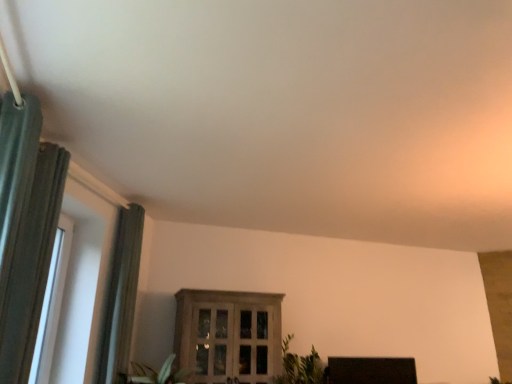
What are the coordinates of `black matte tv at lower right` in the screenshot? It's located at (371, 370).

Locate an element on the screen. The image size is (512, 384). wooden cabinet at center, the 2th window when ordered from left to right is located at coordinates (228, 335).

Image resolution: width=512 pixels, height=384 pixels. I want to click on green leafy plant at lower center, so click(x=301, y=367).

In terms of size, does green fabric curtain at left, placed as the first curtain when sorted from front to back, appear bigger or smaller than white plastic window at left, which ranks as the first window in left-to-right order?

Considering their sizes, green fabric curtain at left, placed as the first curtain when sorted from front to back, takes up more space than white plastic window at left, which ranks as the first window in left-to-right order.

Could you tell me if green fabric curtain at left, positioned as the second curtain in back-to-front order, is facing white plastic window at left, which is the 1th window from front to back?

No, green fabric curtain at left, positioned as the second curtain in back-to-front order, does not turn towards white plastic window at left, which is the 1th window from front to back.

Does green fabric curtain at left, placed as the first curtain when sorted from front to back, lie behind white plastic window at left, which is the 1th window from front to back?

That is False.

From the picture: Which of these two, green fabric curtain at left, positioned as the second curtain in back-to-front order, or white plastic window at left, which ranks as the first window in left-to-right order, is wider?

Wider between the two is green fabric curtain at left, positioned as the second curtain in back-to-front order.

Is green leafy plant at lower center far from white plastic window at left, which ranks as the first window in left-to-right order?

Indeed, green leafy plant at lower center is not near white plastic window at left, which ranks as the first window in left-to-right order.

Does green leafy plant at lower center have a greater height compared to white plastic window at left, which is the 1th window from front to back?

No.

Is green leafy plant at lower center at the right side of white plastic window at left, the second window viewed from the back?

Yes.

What's the angular difference between green leafy plant at lower center and white plastic window at left, which ranks as the first window in left-to-right order,'s facing directions?

They differ by 60 degrees in their facing directions.

Can green fabric curtain at left, positioned as the second curtain in back-to-front order, be found inside green leafy plant at lower center?

That's incorrect, green fabric curtain at left, positioned as the second curtain in back-to-front order, is not inside green leafy plant at lower center.

Looking at this image, from a real-world perspective, which object rests below the other?

In real-world perspective, green leafy plant at lower center is lower.

Is point (320, 360) closer or farther from the camera than point (23, 243)?

Point (320, 360) is positioned farther from the camera compared to point (23, 243).

Is green leafy plant at lower center wider or thinner than green fabric curtain at left, placed as the first curtain when sorted from front to back?

In the image, green leafy plant at lower center appears to be wider than green fabric curtain at left, placed as the first curtain when sorted from front to back.

Is point (396, 358) positioned before point (67, 246)?

No.

Which is behind, black matte tv at lower right or white plastic window at left, which is the 1th window from front to back?

Positioned behind is black matte tv at lower right.

In terms of size, does black matte tv at lower right appear bigger or smaller than white plastic window at left, which is counted as the second window, starting from the right?

In the image, black matte tv at lower right appears to be larger than white plastic window at left, which is counted as the second window, starting from the right.

From the image's perspective, who appears lower, wooden cabinet at center, which appears as the first window when viewed from the back, or green leafy plant at lower center?

green leafy plant at lower center, from the image's perspective.

From a real-world perspective, between wooden cabinet at center, placed as the 1th window when sorted from right to left, and green leafy plant at lower center, who is vertically higher?

In real-world perspective, wooden cabinet at center, placed as the 1th window when sorted from right to left, is above.

Would you say wooden cabinet at center, which appears as the first window when viewed from the back, is to the left or to the right of green leafy plant at lower center in the picture?

In the image, wooden cabinet at center, which appears as the first window when viewed from the back, appears on the left side of green leafy plant at lower center.

Where is `the 1st window counting from the left of the green leafy plant at lower center`? the 1st window counting from the left of the green leafy plant at lower center is located at coordinates (228, 335).

Is black matte tv at lower right in front of green fabric curtain at left, placed as the first curtain when sorted from front to back?

No, the depth of black matte tv at lower right is greater than that of green fabric curtain at left, placed as the first curtain when sorted from front to back.

Could you tell me if black matte tv at lower right is turned towards green fabric curtain at left, placed as the first curtain when sorted from front to back?

No, black matte tv at lower right is not turned towards green fabric curtain at left, placed as the first curtain when sorted from front to back.

Is black matte tv at lower right inside the boundaries of green fabric curtain at left, placed as the first curtain when sorted from front to back, or outside?

black matte tv at lower right is spatially situated outside green fabric curtain at left, placed as the first curtain when sorted from front to back.

Who is taller, green textured curtain at left, positioned as the first curtain in back-to-front order, or green leafy plant at lower center?

Standing taller between the two is green textured curtain at left, positioned as the first curtain in back-to-front order.

In the scene shown: How much distance is there between green textured curtain at left, positioned as the first curtain in back-to-front order, and green leafy plant at lower center?

The distance of green textured curtain at left, positioned as the first curtain in back-to-front order, from green leafy plant at lower center is 5.45 feet.

Does green textured curtain at left, acting as the 2th curtain starting from the front, have a greater width compared to green leafy plant at lower center?

Incorrect, the width of green textured curtain at left, acting as the 2th curtain starting from the front, does not surpass that of green leafy plant at lower center.

From the image's perspective, which is above, green textured curtain at left, acting as the 2th curtain starting from the front, or green leafy plant at lower center?

green textured curtain at left, acting as the 2th curtain starting from the front, appears higher in the image.

The height and width of the screenshot is (384, 512). In order to click on window that is the 1st object located behind the green fabric curtain at left, positioned as the second curtain in back-to-front order in this screenshot , I will do `click(52, 303)`.

Identify the location of window that is the 2nd one above the green leafy plant at lower center (from a real-world perspective). (52, 303).

Looking at this image, estimate the real-world distances between objects in this image. Which object is closer to green leafy plant at lower center, green fabric curtain at left, positioned as the second curtain in back-to-front order, or white plastic window at left, which ranks as the first window in left-to-right order?

The object closer to green leafy plant at lower center is white plastic window at left, which ranks as the first window in left-to-right order.

Based on the photo, which object lies further to the anchor point green leafy plant at lower center, white plastic window at left, which is counted as the second window, starting from the right, or green textured curtain at left, positioned as the first curtain in back-to-front order?

white plastic window at left, which is counted as the second window, starting from the right, lies further to green leafy plant at lower center than the other object.

Looking at the image, which one is located further to green textured curtain at left, positioned as the first curtain in back-to-front order, black matte tv at lower right or green leafy plant at lower center?

black matte tv at lower right is positioned further to the anchor green textured curtain at left, positioned as the first curtain in back-to-front order.

Considering their positions, is wooden cabinet at center, which appears as the 2th window when viewed from the front, positioned further to black matte tv at lower right than white plastic window at left, the second window viewed from the back?

white plastic window at left, the second window viewed from the back, lies further to black matte tv at lower right than the other object.

Estimate the real-world distances between objects in this image. Which object is closer to green textured curtain at left, positioned as the first curtain in back-to-front order, green leafy plant at lower center or wooden cabinet at center, which appears as the first window when viewed from the back?

wooden cabinet at center, which appears as the first window when viewed from the back, is closer to green textured curtain at left, positioned as the first curtain in back-to-front order.

When comparing their distances from green fabric curtain at left, placed as the first curtain when sorted from front to back, does wooden cabinet at center, placed as the 1th window when sorted from right to left, or green textured curtain at left, acting as the 2th curtain starting from the front, seem closer?

Among the two, green textured curtain at left, acting as the 2th curtain starting from the front, is located nearer to green fabric curtain at left, placed as the first curtain when sorted from front to back.

Looking at the image, which one is located further to green leafy plant at lower center, wooden cabinet at center, the 2th window when ordered from left to right, or green fabric curtain at left, positioned as the second curtain in back-to-front order?

The object further to green leafy plant at lower center is green fabric curtain at left, positioned as the second curtain in back-to-front order.

Based on the photo, based on their spatial positions, is green textured curtain at left, positioned as the first curtain in back-to-front order, or green leafy plant at lower center further from white plastic window at left, the second window viewed from the back?

green leafy plant at lower center is positioned further to the anchor white plastic window at left, the second window viewed from the back.

I want to click on window situated between green textured curtain at left, acting as the 2th curtain starting from the front, and black matte tv at lower right from left to right, so click(228, 335).

The height and width of the screenshot is (384, 512). What are the coordinates of `houseplant between green fabric curtain at left, placed as the first curtain when sorted from front to back, and black matte tv at lower right in the front-back direction` in the screenshot? It's located at (301, 367).

Find the location of a particular element. This screenshot has width=512, height=384. curtain located between green fabric curtain at left, placed as the first curtain when sorted from front to back, and wooden cabinet at center, placed as the 1th window when sorted from right to left, in the depth direction is located at coordinates 121,297.

You are a GUI agent. You are given a task and a screenshot of the screen. Output one action in this format:
    pyautogui.click(x=<x>, y=<y>)
    Task: Click on the window between green textured curtain at left, positioned as the first curtain in back-to-front order, and green leafy plant at lower center
    The image size is (512, 384).
    Given the screenshot: What is the action you would take?
    pyautogui.click(x=228, y=335)